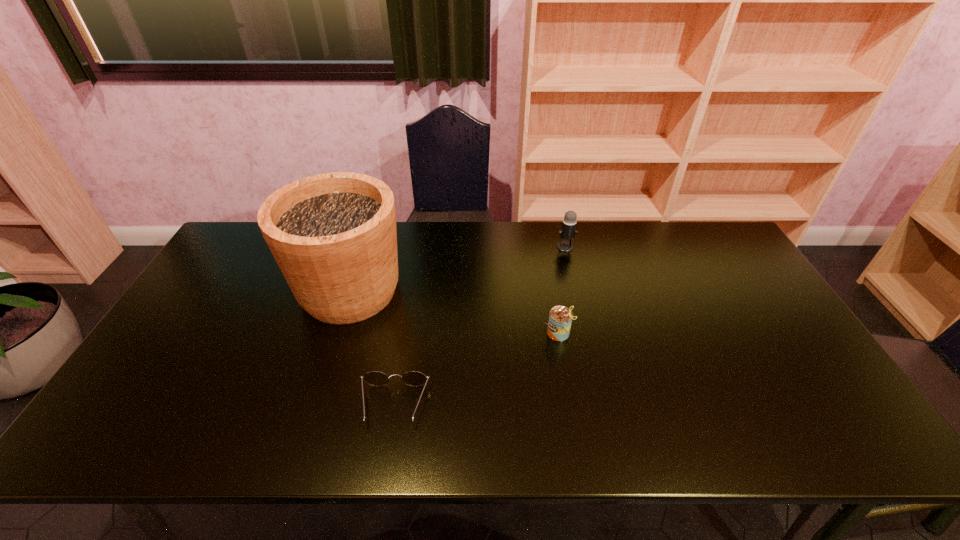
Identify which object is the third nearest to the third shortest object. Please provide its 2D coordinates. Your answer should be formatted as a tuple, i.e. [(x, y)], where the tuple contains the x and y coordinates of a point satisfying the conditions above.

[(375, 378)]

Locate an element on the screen. vacant space that satisfies the following two spatial constraints: 1. on the back side of the second tallest object; 2. on the right side of the can is located at coordinates (543, 247).

Locate an element on the screen. The width and height of the screenshot is (960, 540). free space that satisfies the following two spatial constraints: 1. on the back side of the flowerpot; 2. on the left side of the farthest object is located at coordinates (364, 247).

Identify the location of free space in the image that satisfies the following two spatial constraints: 1. on the front side of the tallest object; 2. on the right side of the third tallest object. (337, 333).